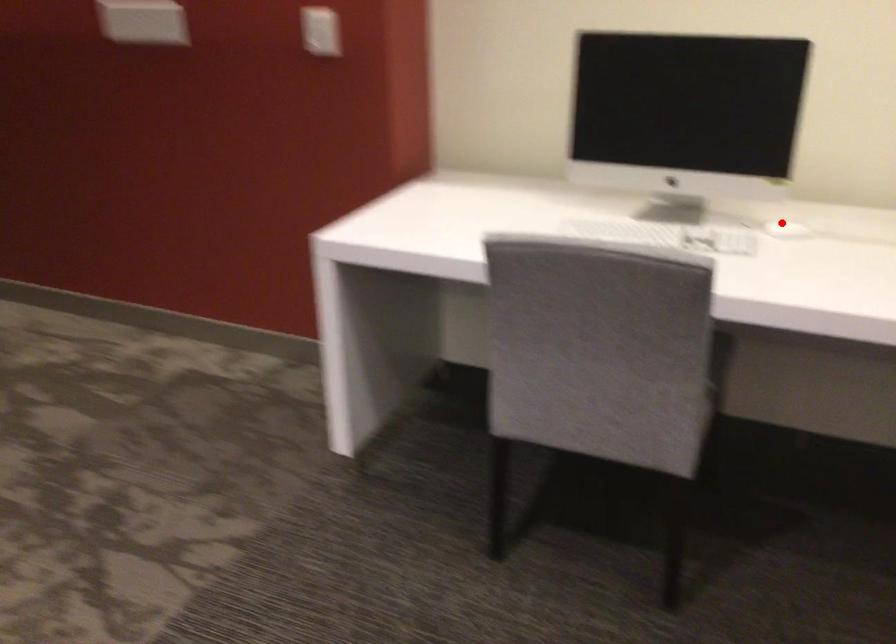
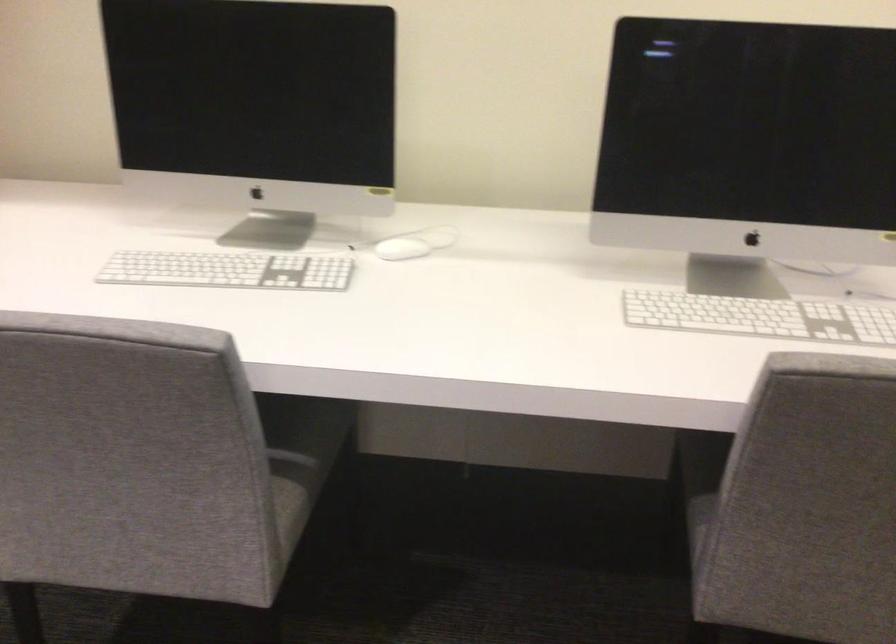
Question: I am providing you with two images of the same scene from different viewpoints. Given a red point in image1, look at the same physical point in image2. Is it:

Choices:
 (A) Closer to the viewpoint
 (B) Farther from the viewpoint

Answer: (A)